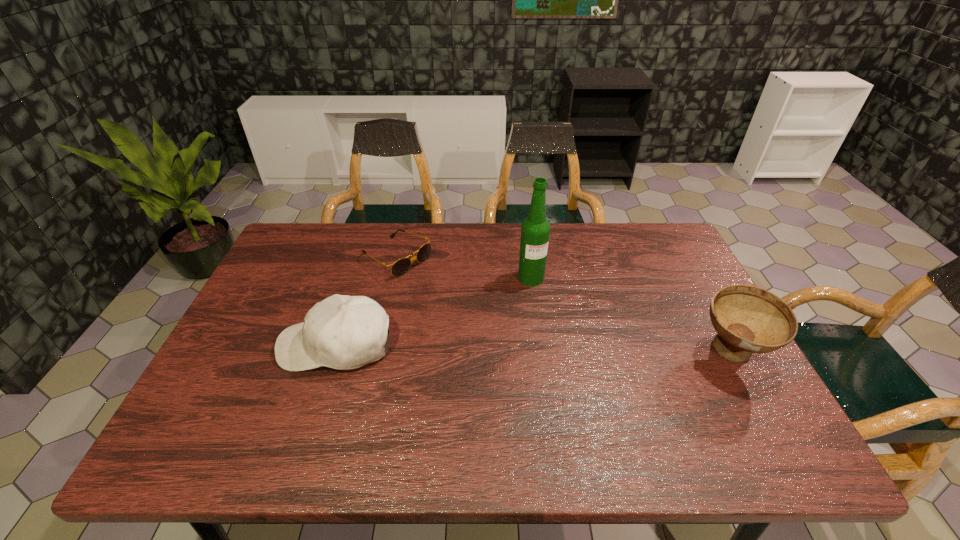
This screenshot has height=540, width=960. I want to click on free space at the left edge of the desktop, so click(240, 372).

Identify the location of free space at the right edge. Image resolution: width=960 pixels, height=540 pixels. (638, 271).

This screenshot has height=540, width=960. Identify the location of free location at the far left corner of the desktop. (289, 257).

This screenshot has height=540, width=960. In the image, there is a desktop. What are the coordinates of `vacant space at the far right corner` in the screenshot? It's located at (667, 248).

Where is `unoccupied position between the rightmost object and the baseball cap`? unoccupied position between the rightmost object and the baseball cap is located at coordinates (534, 349).

Find the location of a particular element. vacant space that's between the shortest object and the soup bowl is located at coordinates click(564, 306).

Where is `vacant space that is in between the baseball cap and the beer bottle`? The width and height of the screenshot is (960, 540). vacant space that is in between the baseball cap and the beer bottle is located at coordinates (x=434, y=312).

Where is `free space between the baseball cap and the second object from right to left`? free space between the baseball cap and the second object from right to left is located at coordinates (434, 312).

You are a GUI agent. You are given a task and a screenshot of the screen. Output one action in this format:
    pyautogui.click(x=<x>, y=<y>)
    Task: Click on the free space between the third object from left to right and the rightmost object
    This screenshot has height=540, width=960.
    Given the screenshot: What is the action you would take?
    pyautogui.click(x=632, y=315)

Locate an element on the screen. This screenshot has height=540, width=960. vacant region between the soup bowl and the shortest object is located at coordinates (564, 306).